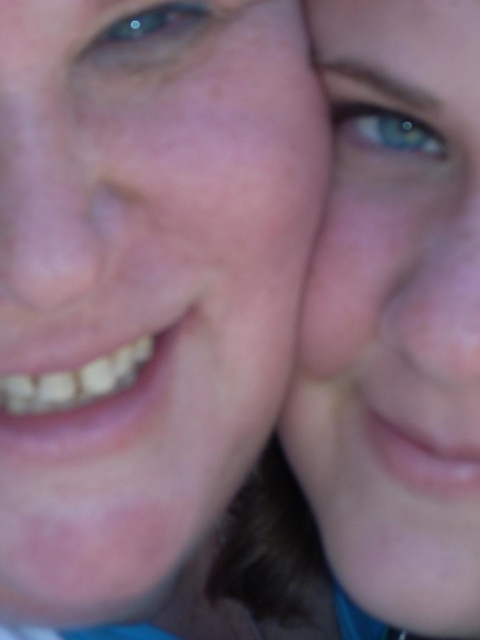
Question: Does smooth skin at center appear on the left side of blue matte skin at upper right?

Choices:
 (A) yes
 (B) no

Answer: (A)

Question: Is smooth skin at center bigger than blue matte skin at upper right?

Choices:
 (A) yes
 (B) no

Answer: (A)

Question: Can you confirm if smooth skin at center is bigger than blue matte skin at upper right?

Choices:
 (A) yes
 (B) no

Answer: (A)

Question: Which object appears farthest from the camera in this image?

Choices:
 (A) smooth skin at center
 (B) blue matte skin at upper right

Answer: (B)